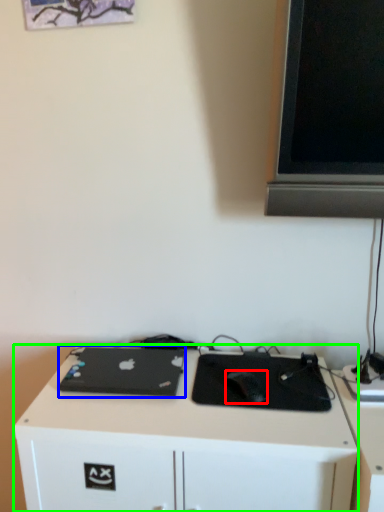
Question: Considering the real-world distances, which object is farthest from mouse (highlighted by a red box)? laptop (highlighted by a blue box) or desk (highlighted by a green box)?

Choices:
 (A) laptop
 (B) desk

Answer: (A)